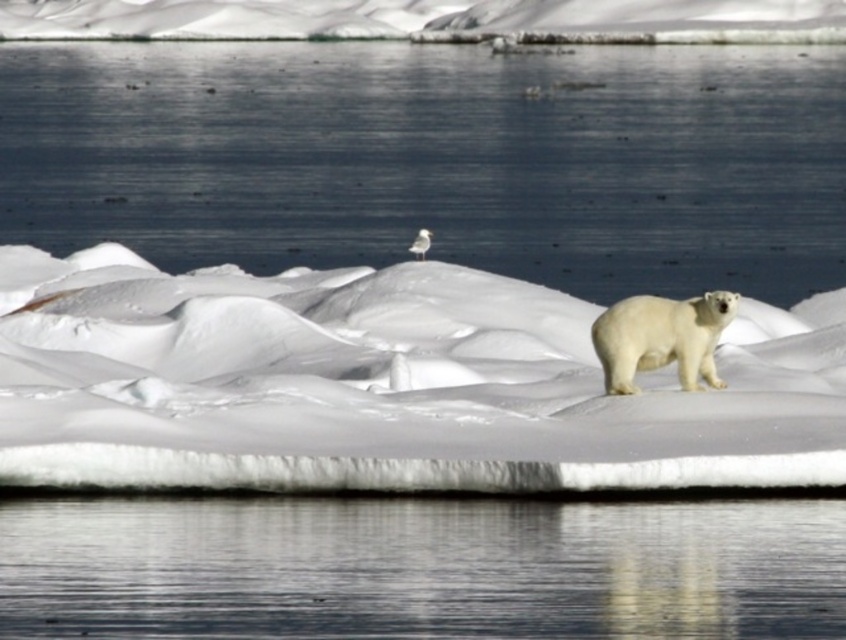
Is transparent water at lower center smaller than white fur polar bear at right?

No.

Between transparent water at lower center and white fur polar bear at right, which one has more height?

white fur polar bear at right

Does point (261, 572) come behind point (680, 324)?

No.

The height and width of the screenshot is (640, 846). Identify the location of transparent water at lower center. (420, 566).

Measure the distance from white fluffy snow at center to transparent water at lower center.

5.38 meters

Where is `white fluffy snow at center`? white fluffy snow at center is located at coordinates (382, 385).

This screenshot has width=846, height=640. Find the location of `white fluffy snow at center`. white fluffy snow at center is located at coordinates click(x=382, y=385).

Who is positioned more to the right, white fluffy snow at center or white fur polar bear at right?

Positioned to the right is white fur polar bear at right.

Does white fluffy snow at center have a larger size compared to white fur polar bear at right?

Yes, white fluffy snow at center is bigger than white fur polar bear at right.

Between point (518, 420) and point (674, 307), which one is positioned in front?

Point (518, 420) is in front.

You are a GUI agent. You are given a task and a screenshot of the screen. Output one action in this format:
    pyautogui.click(x=<x>, y=<y>)
    Task: Click on the white fluffy snow at center
    
    Given the screenshot: What is the action you would take?
    pyautogui.click(x=382, y=385)